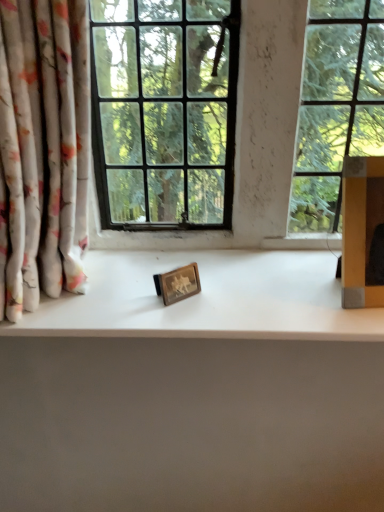
Locate an element on the screen. The width and height of the screenshot is (384, 512). vacant region below floral fabric curtain at left (from a real-world perspective) is located at coordinates (69, 302).